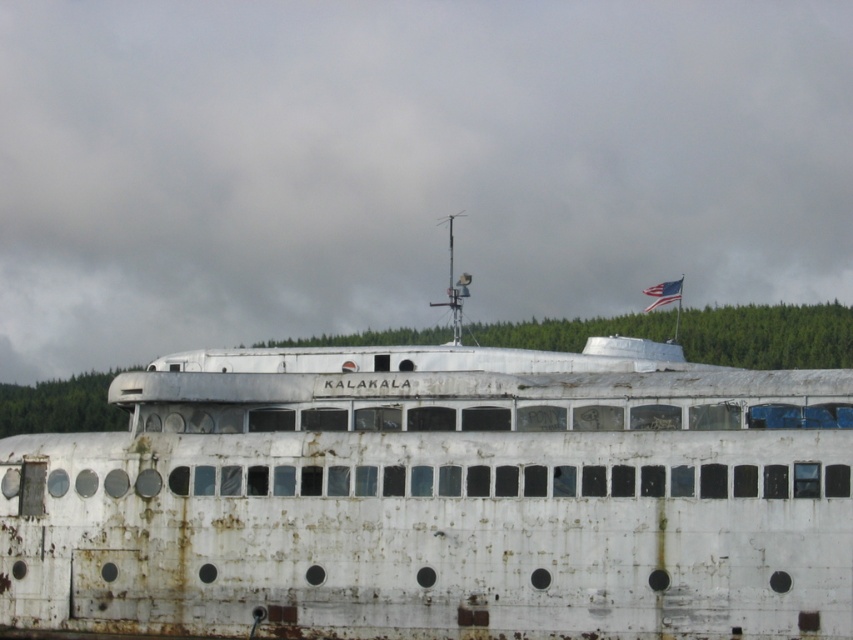
You are standing on a dock and see the rusty white ship at center in the distance. If you want to take a photo of the ship with your phone, which has a maximum zoom range of 100 feet, will you be able to capture the entire ship clearly without moving closer?

The rusty white ship at center is 141.04 feet away from the camera. Since the maximum zoom range of your phone is 100 feet, you will not be able to capture the entire ship clearly without moving closer.

You are a photographer planning to take a photo of the rusty white ship at center and the american flag at upper center. If you want to ensure both objects are fully visible in the frame, which object should you position closer to the edge of the frame to avoid cropping?

You should position the american flag at upper center closer to the edge of the frame because the rusty white ship at center is wider, so it requires more space to fit entirely within the frame.

You are standing on the dock next to the Kalakala ship. You want to take a photo of the ship from a specific point that is exactly 148.33 feet away from the camera. Can you confirm if the point at coordinates point [627,580] on the image corresponds to that distance?

The point at coordinates point [627,580] is exactly 148.33 feet away from the camera, so yes, that point corresponds to the desired distance.